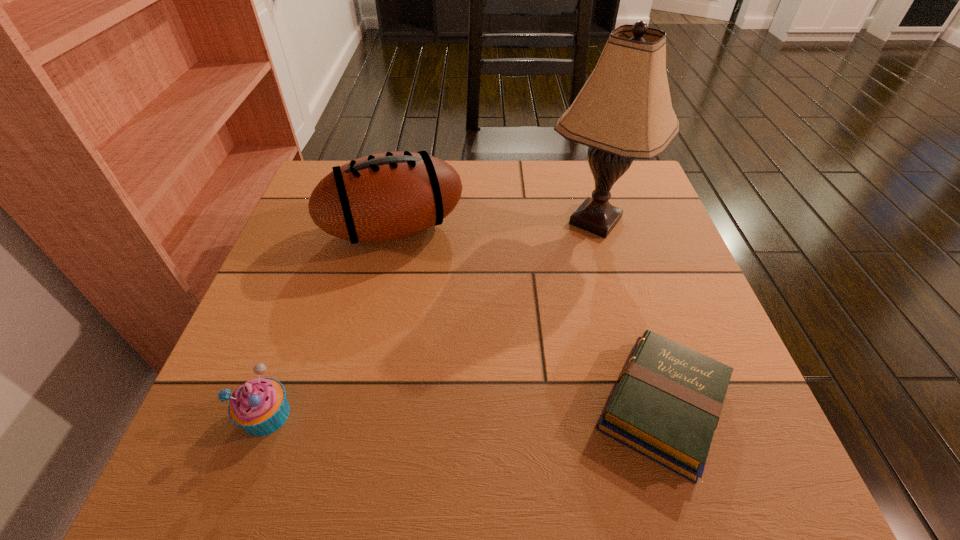
In order to click on muffin that is at the near edge in this screenshot , I will do `click(259, 406)`.

Locate an element on the screen. book located in the near edge section of the desktop is located at coordinates (667, 401).

At what (x,y) coordinates should I click in order to perform the action: click on football (American) at the left edge. Please return your answer as a coordinate pair (x, y). The width and height of the screenshot is (960, 540). Looking at the image, I should click on (387, 196).

The image size is (960, 540). Identify the location of muffin that is positioned at the left edge. (259, 406).

At what (x,y) coordinates should I click in order to perform the action: click on lamp located at the right edge. Please return your answer as a coordinate pair (x, y). The image size is (960, 540). Looking at the image, I should click on (624, 111).

Locate an element on the screen. The image size is (960, 540). book located in the right edge section of the desktop is located at coordinates (667, 401).

You are a GUI agent. You are given a task and a screenshot of the screen. Output one action in this format:
    pyautogui.click(x=<x>, y=<y>)
    Task: Click on the object located at the far left corner
    
    Given the screenshot: What is the action you would take?
    pyautogui.click(x=387, y=196)

I want to click on object positioned at the near left corner, so click(259, 406).

Image resolution: width=960 pixels, height=540 pixels. I want to click on object located in the far right corner section of the desktop, so click(624, 111).

Image resolution: width=960 pixels, height=540 pixels. Identify the location of object that is at the near right corner. (667, 401).